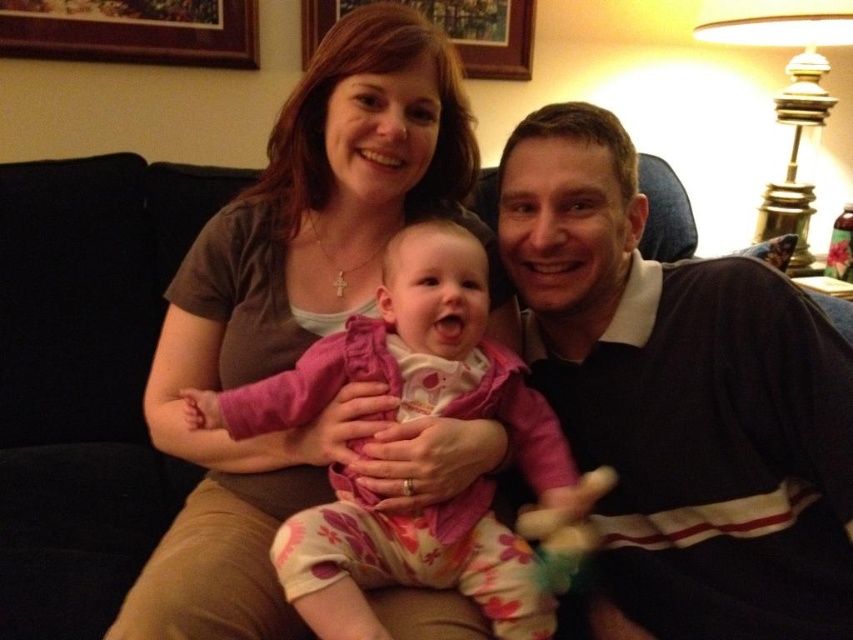
Question: Which object is positioned closest to the pink fleece baby at center?

Choices:
 (A) dark brown jersey at right
 (B) plush pink toy at center

Answer: (B)

Question: Which of the following is the farthest from the observer?

Choices:
 (A) dark brown jersey at right
 (B) pink fleece baby at center
 (C) plush pink toy at center

Answer: (C)

Question: Which of the following is the closest to the observer?

Choices:
 (A) (314, 628)
 (B) (738, 588)
 (C) (535, 570)

Answer: (A)

Question: Can you confirm if dark brown jersey at right is wider than pink fleece baby at center?

Choices:
 (A) no
 (B) yes

Answer: (A)

Question: Does dark brown jersey at right appear on the right side of plush pink toy at center?

Choices:
 (A) yes
 (B) no

Answer: (A)

Question: Is dark brown jersey at right below plush pink toy at center?

Choices:
 (A) no
 (B) yes

Answer: (A)